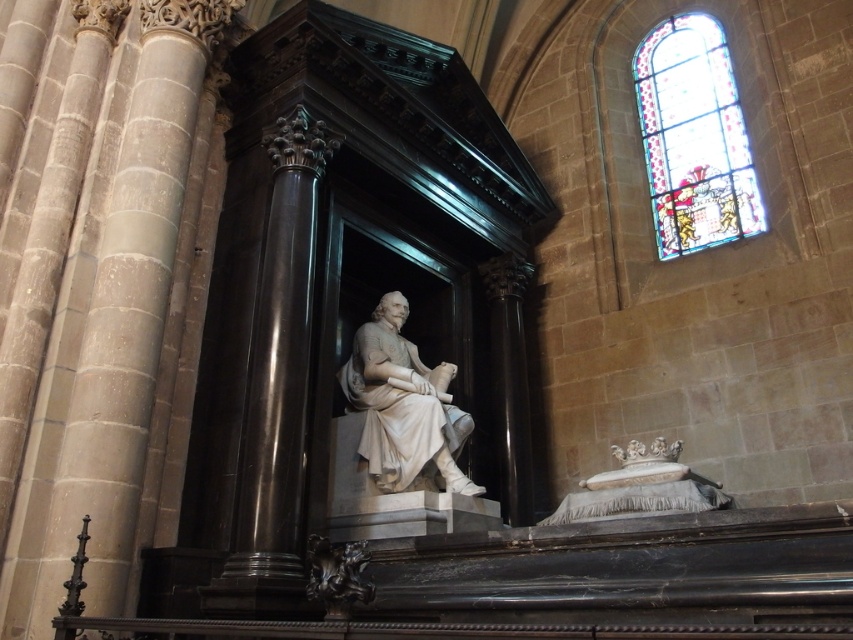
Question: Considering the real-world distances, which object is closest to the white marble statue at center?

Choices:
 (A) white marble bed at lower right
 (B) stained glass at upper right
 (C) polished dark wood carving at lower left

Answer: (A)

Question: Which of the following is the closest to the observer?

Choices:
 (A) stained glass at upper right
 (B) polished dark wood carving at lower left

Answer: (B)

Question: Is stained glass at upper right smaller than polished dark wood carving at lower left?

Choices:
 (A) no
 (B) yes

Answer: (A)

Question: Is white marble bed at lower right to the right of polished dark wood carving at lower left from the viewer's perspective?

Choices:
 (A) no
 (B) yes

Answer: (B)

Question: Can you confirm if stained glass at upper right is wider than white marble statue at center?

Choices:
 (A) no
 (B) yes

Answer: (A)

Question: Which object is positioned farthest from the white marble statue at center?

Choices:
 (A) polished dark wood carving at lower left
 (B) white marble bed at lower right

Answer: (A)